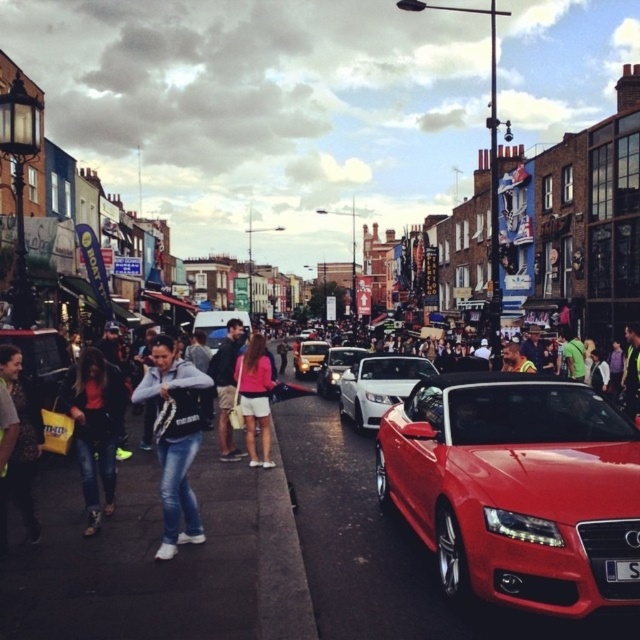
Which is below, denim jacket at center or dark blue jeans at center?

Positioned lower is denim jacket at center.

How much distance is there between denim jacket at center and dark blue jeans at center?

The distance of denim jacket at center from dark blue jeans at center is 14.09 meters.

Who is more forward, (156, 376) or (220, 401)?

Point (156, 376)

This screenshot has height=640, width=640. In order to click on denim jacket at center in this screenshot , I will do `click(173, 438)`.

In the scene shown: Between denim jacket at lower left and white plastic license plate at center, which one is positioned lower?

Positioned lower is white plastic license plate at center.

Does point (115, 376) come in front of point (636, 563)?

No, (115, 376) is behind (636, 563).

The image size is (640, 640). What are the coordinates of `denim jacket at lower left` in the screenshot? It's located at (96, 428).

Can you confirm if denim jacket at center is wider than white plastic license plate at center?

Indeed, denim jacket at center has a greater width compared to white plastic license plate at center.

Who is more distant from viewer, (179,518) or (620,561)?

The point (179,518) is behind.

What are the coordinates of `denim jacket at center` in the screenshot? It's located at (173, 438).